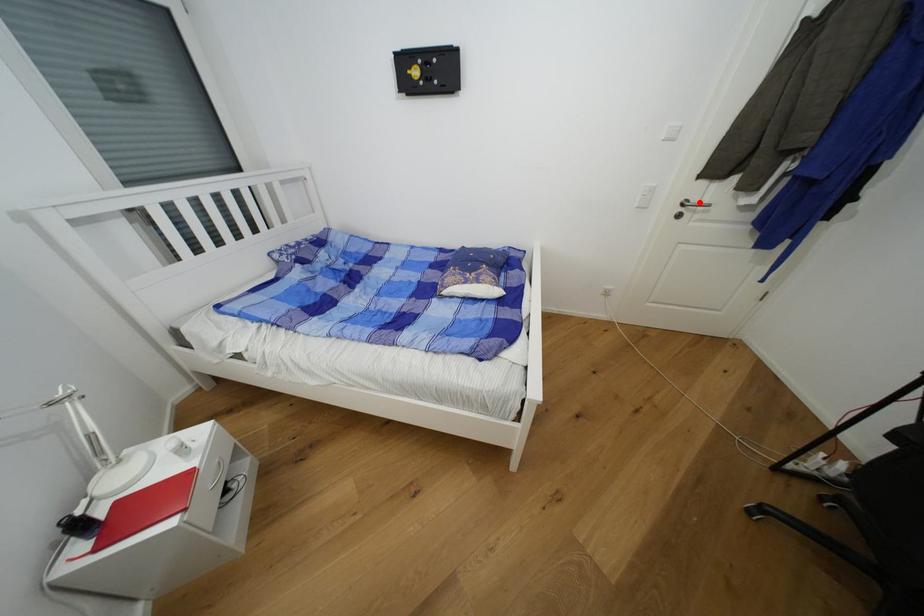
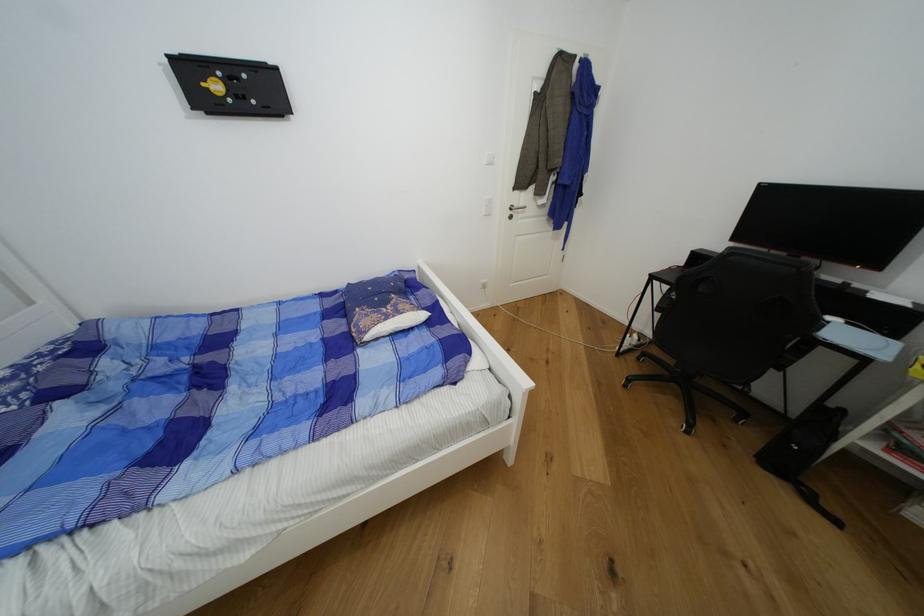
Where in the second image is the point corresponding to the highlighted location from the first image?

(521, 207)